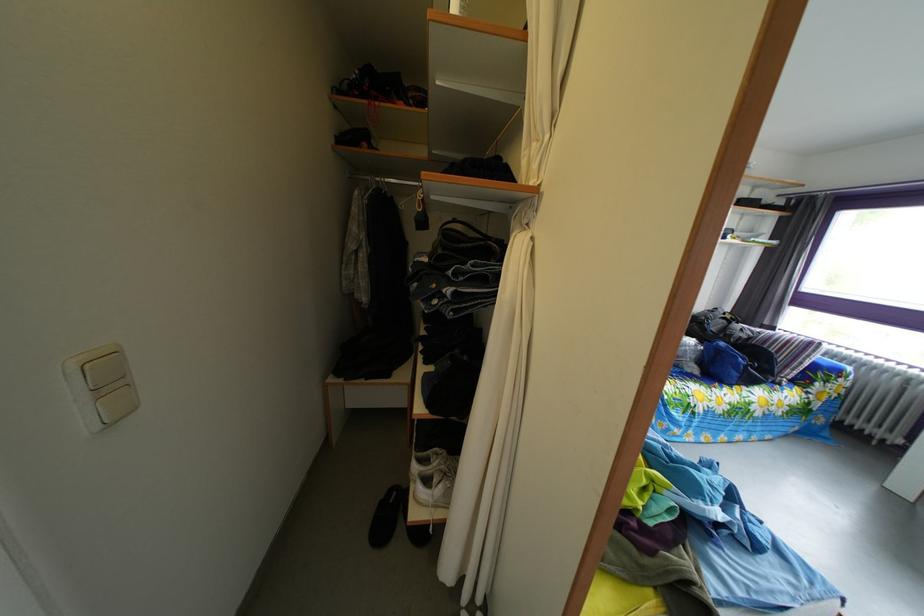
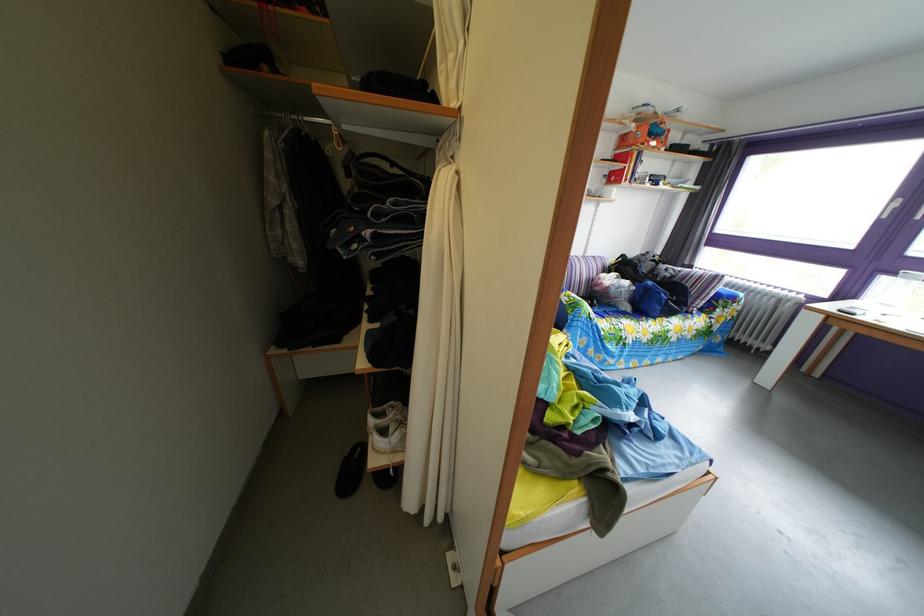
Question: Based on the continuous images, in which direction is the camera rotating? Reply with the corresponding letter.

Choices:
 (A) Left
 (B) Right
 (C) Up
 (D) Down

Answer: (D)